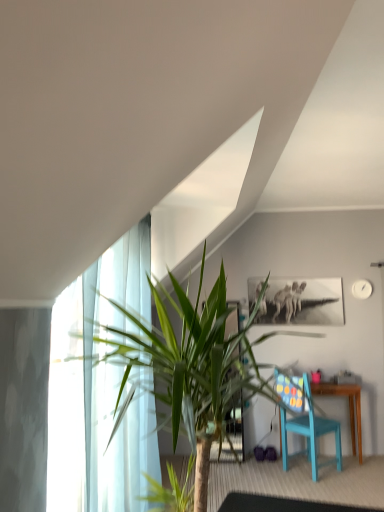
The width and height of the screenshot is (384, 512). What do you see at coordinates (186, 362) in the screenshot? I see `green leafy plant at left` at bounding box center [186, 362].

Where is `transparent glass table at lower center`? transparent glass table at lower center is located at coordinates (282, 504).

Does green leafy plant at left have a smaller size compared to matte blue chair at lower right?

Incorrect, green leafy plant at left is not smaller in size than matte blue chair at lower right.

Can you tell me how much green leafy plant at left and matte blue chair at lower right differ in facing direction?

The angular difference between green leafy plant at left and matte blue chair at lower right is 44.1 degrees.

Is green leafy plant at left aimed at matte blue chair at lower right?

No, green leafy plant at left is not facing towards matte blue chair at lower right.

Locate an element on the screen. chair located behind the green leafy plant at left is located at coordinates (310, 431).

From their relative heights in the image, would you say transparent glass table at lower center is taller or shorter than matte blue chair at lower right?

Considering their sizes, transparent glass table at lower center has less height than matte blue chair at lower right.

Is transparent glass table at lower center far from matte blue chair at lower right?

No, transparent glass table at lower center is in close proximity to matte blue chair at lower right.

From a real-world perspective, does transparent glass table at lower center stand above matte blue chair at lower right?

Incorrect, from a real-world perspective, transparent glass table at lower center is lower than matte blue chair at lower right.

Is transparent glass table at lower center behind matte blue chair at lower right?

No, transparent glass table at lower center is in front of matte blue chair at lower right.

Does matte blue chair at lower right have a greater width compared to green leafy plant at left?

Incorrect, the width of matte blue chair at lower right does not surpass that of green leafy plant at left.

Is matte blue chair at lower right facing away from green leafy plant at left?

matte blue chair at lower right is not turned away from green leafy plant at left.

From a real-world perspective, is matte blue chair at lower right below green leafy plant at left?

Indeed, from a real-world perspective, matte blue chair at lower right is positioned beneath green leafy plant at left.

Identify the location of chair lying below the green leafy plant at left (from the image's perspective). (310, 431).

From a real-world perspective, who is located higher, transparent glass table at lower center or green leafy plant at left?

green leafy plant at left is physically above.

Who is taller, transparent glass table at lower center or green leafy plant at left?

green leafy plant at left.

How different are the orientations of transparent glass table at lower center and green leafy plant at left in degrees?

The facing directions of transparent glass table at lower center and green leafy plant at left are 10.5 degrees apart.

This screenshot has width=384, height=512. In the image, there is a green leafy plant at left. Find the location of `glass table below it (from a real-world perspective)`. glass table below it (from a real-world perspective) is located at coordinates (282, 504).

Is green leafy plant at left touching transparent glass table at lower center?

No, green leafy plant at left is not next to transparent glass table at lower center.

Does green leafy plant at left have a lesser height compared to transparent glass table at lower center?

No.

Does point (221, 335) come behind point (262, 506)?

No, it is in front of (262, 506).

Is matte blue chair at lower right looking in the opposite direction of transparent glass table at lower center?

No, matte blue chair at lower right is not facing the opposite direction of transparent glass table at lower center.

Based on the photo, which is more to the left, matte blue chair at lower right or transparent glass table at lower center?

transparent glass table at lower center.

From a real-world perspective, between matte blue chair at lower right and transparent glass table at lower center, who is vertically higher?

matte blue chair at lower right.

Would you say matte blue chair at lower right is a long distance from transparent glass table at lower center?

No, matte blue chair at lower right is not far away from transparent glass table at lower center.

In the image, there is a matte blue chair at lower right. In order to click on houseplant above it (from the image's perspective) in this screenshot , I will do `click(186, 362)`.

The height and width of the screenshot is (512, 384). In order to click on glass table below the matte blue chair at lower right (from the image's perspective) in this screenshot , I will do `click(282, 504)`.

Which object lies further to the anchor point transparent glass table at lower center, green leafy plant at left or matte blue chair at lower right?

The object further to transparent glass table at lower center is green leafy plant at left.

From the image, which object appears to be nearer to matte blue chair at lower right, transparent glass table at lower center or green leafy plant at left?

transparent glass table at lower center is positioned closer to the anchor matte blue chair at lower right.

Considering their positions, is matte blue chair at lower right positioned further to green leafy plant at left than transparent glass table at lower center?

matte blue chair at lower right lies further to green leafy plant at left than the other object.

From the image, which object appears to be farther from matte blue chair at lower right, green leafy plant at left or transparent glass table at lower center?

green leafy plant at left is positioned further to the anchor matte blue chair at lower right.

Based on their spatial positions, is matte blue chair at lower right or green leafy plant at left further from transparent glass table at lower center?

green leafy plant at left.

Looking at the image, which one is located closer to green leafy plant at left, transparent glass table at lower center or matte blue chair at lower right?

transparent glass table at lower center.

Identify the location of glass table between green leafy plant at left and matte blue chair at lower right in the front-back direction. (282, 504).